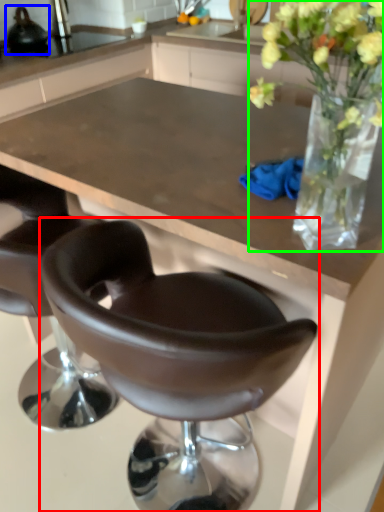
Question: Considering the real-world distances, which object is farthest from chair (highlighted by a red box)? appliance (highlighted by a blue box) or floral arrangement (highlighted by a green box)?

Choices:
 (A) appliance
 (B) floral arrangement

Answer: (A)